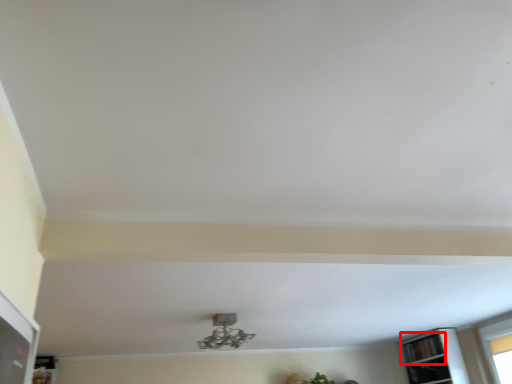
Question: Considering the relative positions of shelf (annotated by the red box) and lamp in the image provided, where is shelf (annotated by the red box) located with respect to the staircase?

Choices:
 (A) right
 (B) left

Answer: (A)